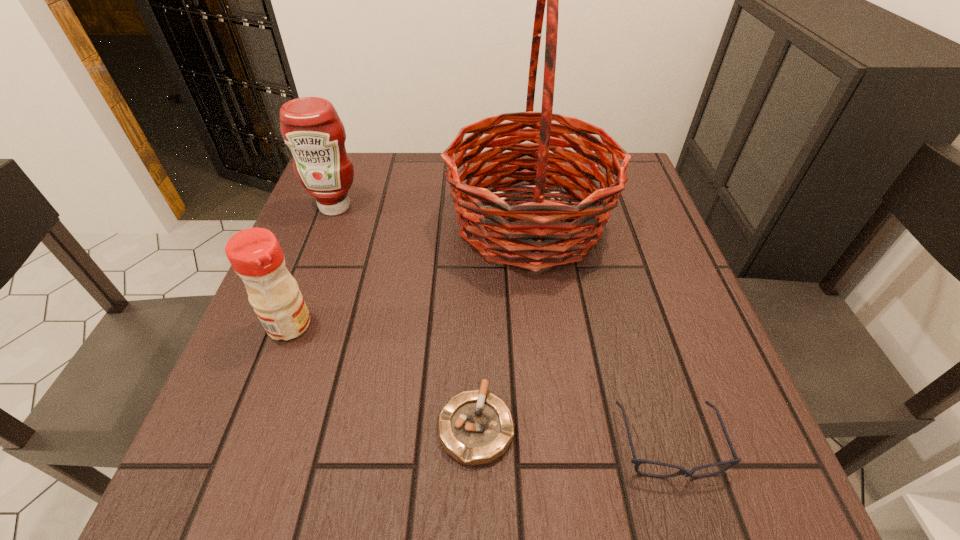
Locate an element on the screen. vacant area in the image that satisfies the following two spatial constraints: 1. on the front side of the ashtray; 2. on the right side of the farther condiment is located at coordinates (252, 426).

Locate an element on the screen. The height and width of the screenshot is (540, 960). vacant space that satisfies the following two spatial constraints: 1. on the front side of the ashtray; 2. on the right side of the second tallest object is located at coordinates (252, 426).

At what (x,y) coordinates should I click in order to perform the action: click on free point that satisfies the following two spatial constraints: 1. on the front side of the shortest object; 2. on the right side of the second tallest object. Please return your answer as a coordinate pair (x, y). The width and height of the screenshot is (960, 540). Looking at the image, I should click on (252, 426).